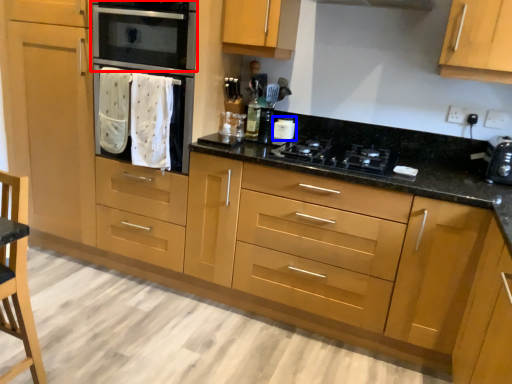
Question: Which object appears farthest to the camera in this image, home appliance (highlighted by a red box) or kitchen appliance (highlighted by a blue box)?

Choices:
 (A) home appliance
 (B) kitchen appliance

Answer: (B)